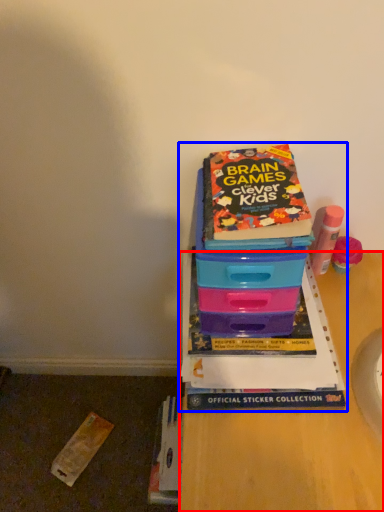
Question: Which object is further to the camera taking this photo, desk (highlighted by a red box) or book (highlighted by a blue box)?

Choices:
 (A) desk
 (B) book

Answer: (B)